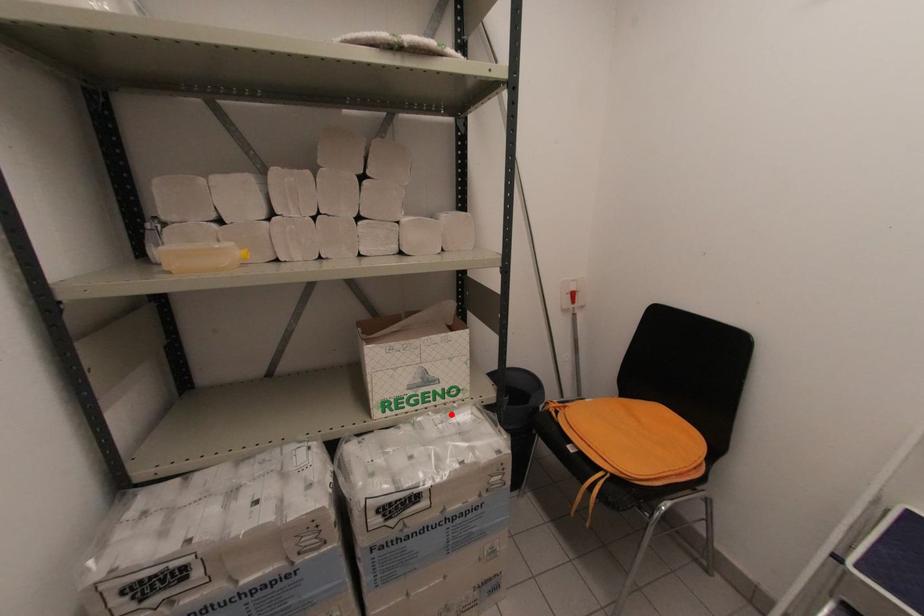
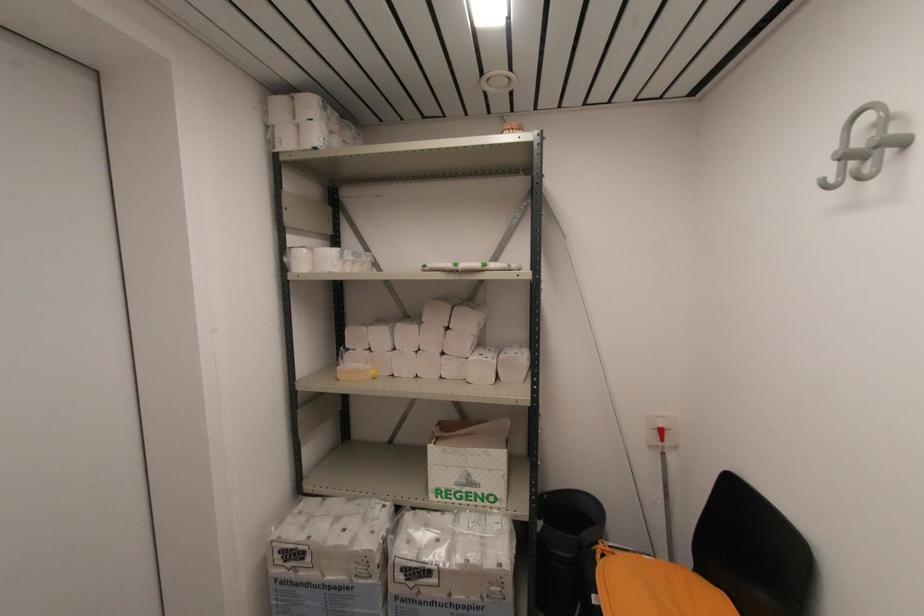
The point at the highlighted location is marked in the first image. Where is the corresponding point in the second image?

(484, 517)